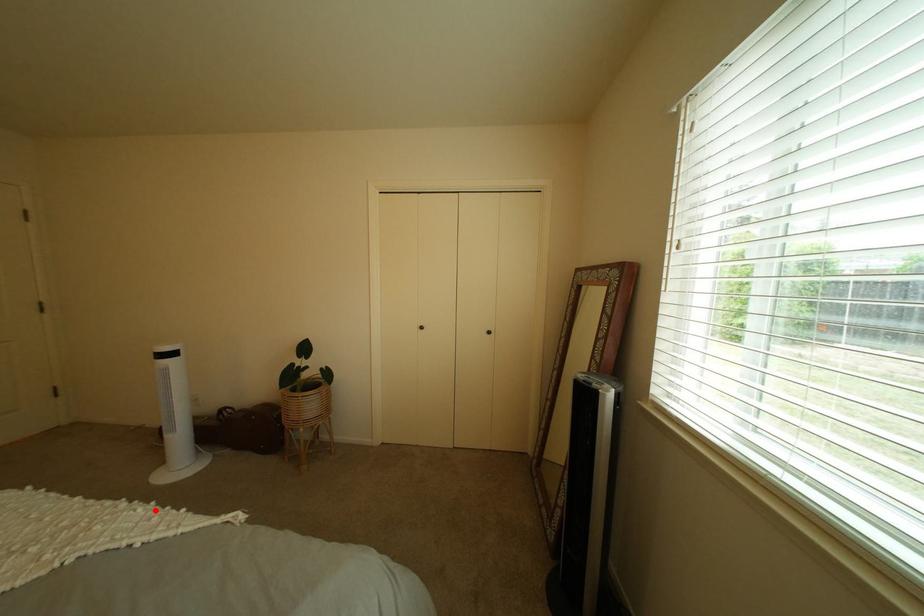
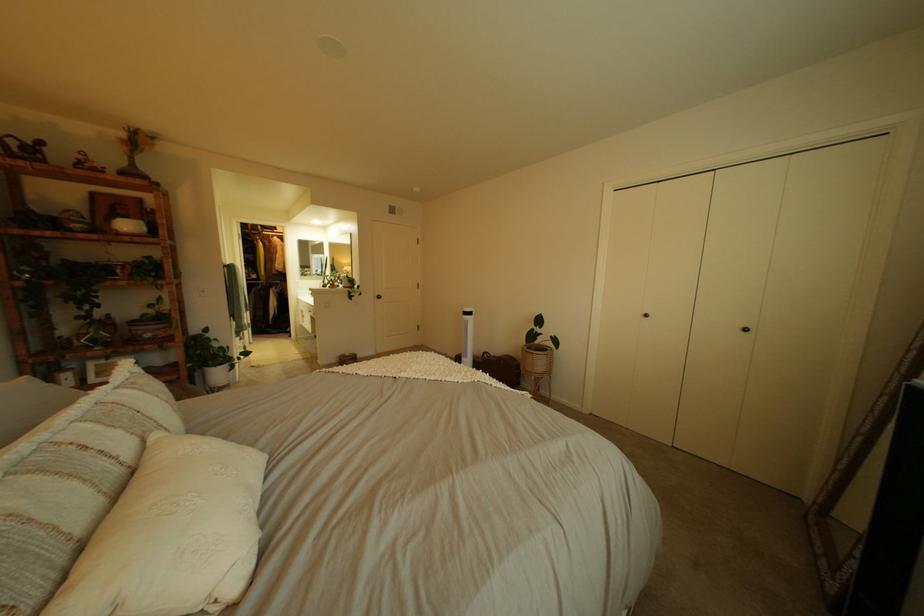
Question: I am providing you with two images of the same scene from different viewpoints. A red point is shown in image1. For the corresponding object point in image2, is it positioned nearer or farther from the camera?

Choices:
 (A) Nearer
 (B) Farther

Answer: (A)